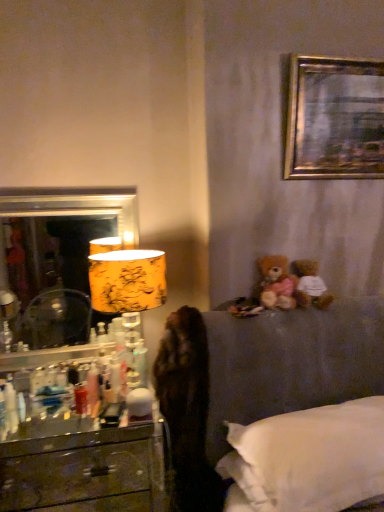
Question: Is wooden drawer at lower left positioned before gold metallic picture frame at upper right?

Choices:
 (A) no
 (B) yes

Answer: (A)

Question: Does wooden drawer at lower left come behind gold metallic picture frame at upper right?

Choices:
 (A) yes
 (B) no

Answer: (A)

Question: From a real-world perspective, does wooden drawer at lower left stand above gold metallic picture frame at upper right?

Choices:
 (A) yes
 (B) no

Answer: (B)

Question: Is wooden drawer at lower left oriented away from gold metallic picture frame at upper right?

Choices:
 (A) yes
 (B) no

Answer: (B)

Question: Is wooden drawer at lower left outside of gold metallic picture frame at upper right?

Choices:
 (A) yes
 (B) no

Answer: (A)

Question: From a real-world perspective, is wooden drawer at lower left positioned under gold metallic picture frame at upper right based on gravity?

Choices:
 (A) yes
 (B) no

Answer: (A)

Question: Does white plush teddy bear at upper right, the second teddy bear positioned from the left, have a greater height compared to brown plush teddy bear at upper right, acting as the first teddy bear starting from the left?

Choices:
 (A) yes
 (B) no

Answer: (B)

Question: Is white plush teddy bear at upper right, marked as the first teddy bear in a right-to-left arrangement, at the left side of brown plush teddy bear at upper right, acting as the first teddy bear starting from the left?

Choices:
 (A) yes
 (B) no

Answer: (B)

Question: Is white plush teddy bear at upper right, the second teddy bear positioned from the left, completely or partially outside of brown plush teddy bear at upper right, acting as the first teddy bear starting from the left?

Choices:
 (A) yes
 (B) no

Answer: (A)

Question: Considering the relative sizes of white plush teddy bear at upper right, marked as the first teddy bear in a right-to-left arrangement, and brown plush teddy bear at upper right, acting as the first teddy bear starting from the left, in the image provided, is white plush teddy bear at upper right, marked as the first teddy bear in a right-to-left arrangement, smaller than brown plush teddy bear at upper right, acting as the first teddy bear starting from the left,?

Choices:
 (A) yes
 (B) no

Answer: (B)

Question: Is white plush teddy bear at upper right, marked as the first teddy bear in a right-to-left arrangement, oriented away from brown plush teddy bear at upper right, marked as the 2th teddy bear in a right-to-left arrangement?

Choices:
 (A) no
 (B) yes

Answer: (A)

Question: Does white plush teddy bear at upper right, marked as the first teddy bear in a right-to-left arrangement, have a lesser height compared to brown plush teddy bear at upper right, acting as the first teddy bear starting from the left?

Choices:
 (A) yes
 (B) no

Answer: (A)

Question: From a real-world perspective, is white plush teddy bear at upper right, marked as the first teddy bear in a right-to-left arrangement, on fuzzy brown teddy bear at left?

Choices:
 (A) yes
 (B) no

Answer: (A)